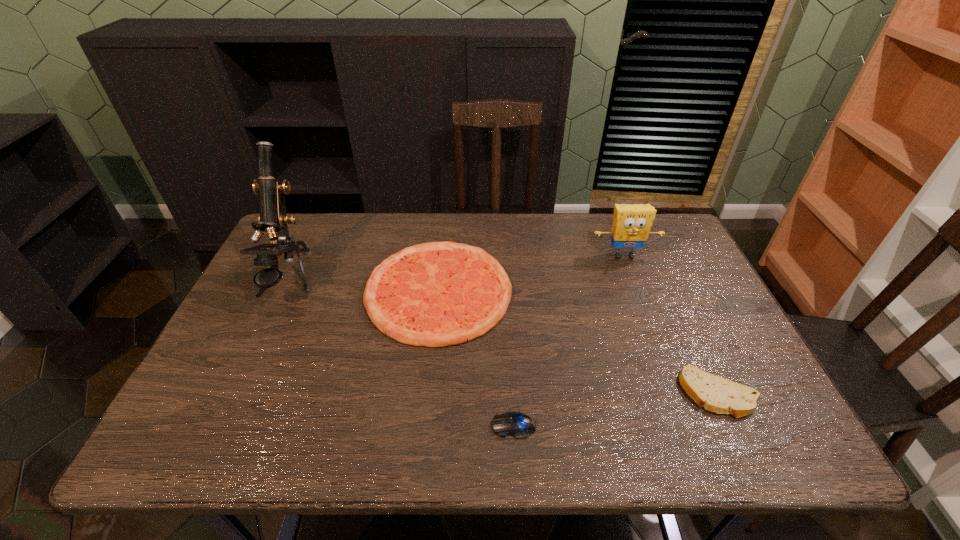
Find the location of a particular element. The height and width of the screenshot is (540, 960). free space located on the button side of the computer mouse is located at coordinates (337, 426).

You are a GUI agent. You are given a task and a screenshot of the screen. Output one action in this format:
    pyautogui.click(x=<x>, y=<y>)
    Task: Click on the free space located 0.360m on the button side of the computer mouse
    
    Given the screenshot: What is the action you would take?
    pyautogui.click(x=323, y=426)

I want to click on vacant space located 0.240m on the button side of the computer mouse, so click(x=379, y=426).

This screenshot has width=960, height=540. I want to click on microscope that is at the far edge, so click(x=272, y=219).

Where is `sponge situated at the far edge`? The width and height of the screenshot is (960, 540). sponge situated at the far edge is located at coordinates (631, 224).

The height and width of the screenshot is (540, 960). I want to click on pizza located at the far edge, so click(436, 294).

In order to click on pita bread present at the near edge in this screenshot , I will do `click(716, 394)`.

I want to click on computer mouse at the near edge, so click(x=519, y=425).

Identify the location of object located in the left edge section of the desktop. (272, 219).

This screenshot has width=960, height=540. I want to click on sponge present at the right edge, so [x=631, y=224].